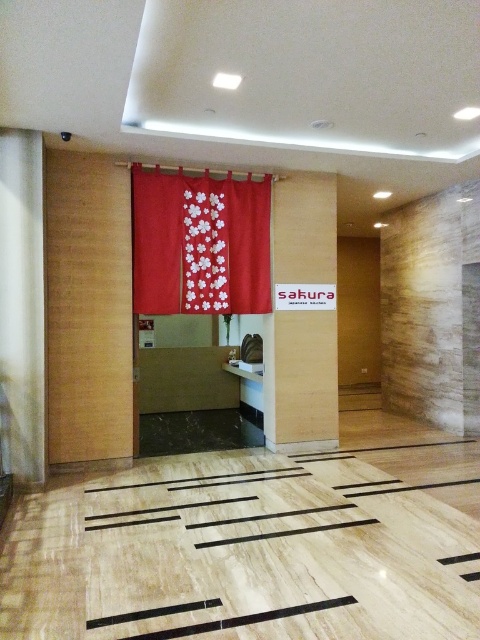
You are a delivery person trying to enter the establishment. You see the red floral fabric curtain at center and the wooden sign at center. How far apart are they?

A: The red floral fabric curtain at center and the wooden sign at center are 3.39 feet apart.

You are a guest entering the establishment and want to read the wooden sign at center. However, there is a red floral fabric curtain at center in your way. Can you easily read the sign without moving the curtain?

The red floral fabric curtain at center is closer to the viewer than the wooden sign at center, so the curtain blocks the view of the sign. You would need to move the curtain to read the wooden sign at center clearly.